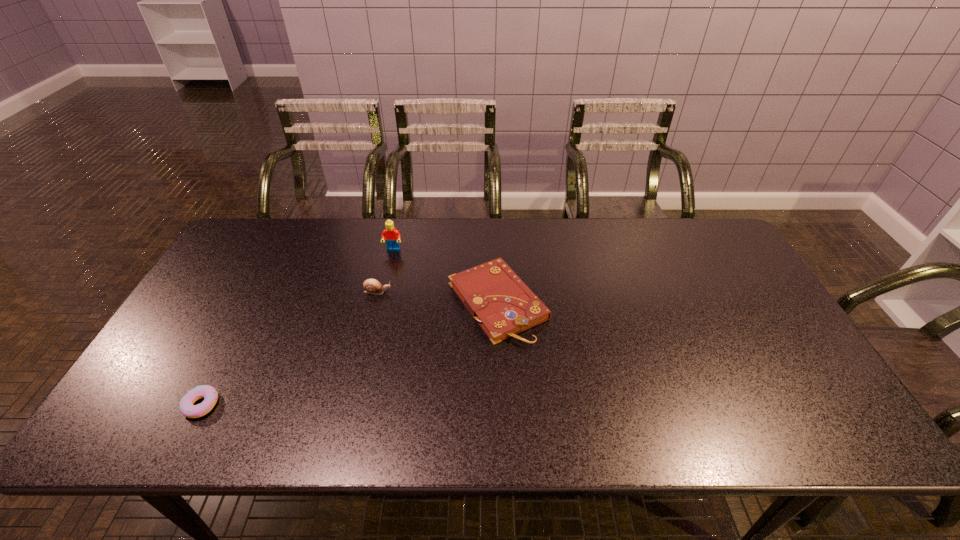
I want to click on vacant space in between the rightmost object and the farthest object, so click(445, 276).

You are a GUI agent. You are given a task and a screenshot of the screen. Output one action in this format:
    pyautogui.click(x=<x>, y=<y>)
    Task: Click on the vacant space in between the farthest object and the leftmost object
    Image resolution: width=960 pixels, height=540 pixels.
    Given the screenshot: What is the action you would take?
    pyautogui.click(x=298, y=327)

Where is `vacant region between the tallest object and the nearest object`? vacant region between the tallest object and the nearest object is located at coordinates (298, 327).

This screenshot has width=960, height=540. Find the location of `vacant space that is in between the escargot and the rightmost object`. vacant space that is in between the escargot and the rightmost object is located at coordinates click(438, 297).

Locate an element on the screen. The image size is (960, 540). vacant area that lies between the tallest object and the doughnut is located at coordinates (298, 327).

Find the location of a particular element. The width and height of the screenshot is (960, 540). free space between the farthest object and the rightmost object is located at coordinates (445, 276).

At what (x,y) coordinates should I click in order to perform the action: click on unoccupied area between the doughnut and the Lego. Please return your answer as a coordinate pair (x, y). This screenshot has width=960, height=540. Looking at the image, I should click on (298, 327).

This screenshot has width=960, height=540. Find the location of `vacant space that's between the Lego and the notebook`. vacant space that's between the Lego and the notebook is located at coordinates (445, 276).

This screenshot has width=960, height=540. Identify the location of vacant area that lies between the escargot and the notebook. (438, 297).

Where is `the third closest object to the escargot`? the third closest object to the escargot is located at coordinates (209, 393).